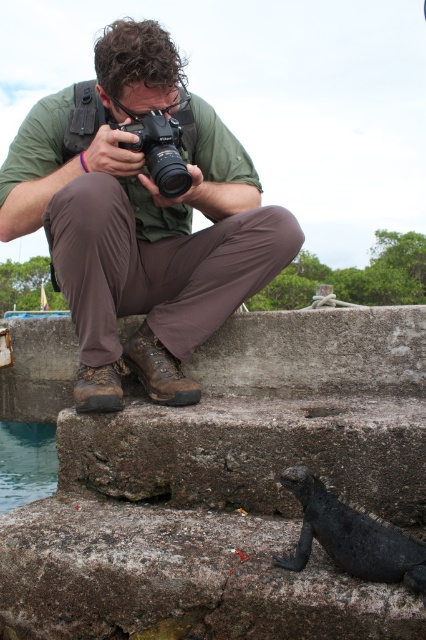
Is shiny black lizard at lower right above black plastic camera at center?

Actually, shiny black lizard at lower right is below black plastic camera at center.

Between shiny black lizard at lower right and black plastic camera at center, which one is positioned lower?

Positioned lower is shiny black lizard at lower right.

Is point (380, 534) behind point (161, 140)?

No, it is in front of (161, 140).

This screenshot has width=426, height=640. I want to click on shiny black lizard at lower right, so click(351, 536).

Between green matte shirt at center and black plastic camera at center, which one is positioned higher?

black plastic camera at center

Who is positioned more to the left, green matte shirt at center or black plastic camera at center?

green matte shirt at center is more to the left.

Locate an element on the screen. The image size is (426, 640). green matte shirt at center is located at coordinates (141, 221).

Does green matte shirt at center have a greater width compared to shiny black lizard at lower right?

Yes.

Does green matte shirt at center have a lesser height compared to shiny black lizard at lower right?

No, green matte shirt at center is not shorter than shiny black lizard at lower right.

Which is in front, point (227, 220) or point (373, 580)?

Point (373, 580)

Locate an element on the screen. The width and height of the screenshot is (426, 640). green matte shirt at center is located at coordinates (141, 221).